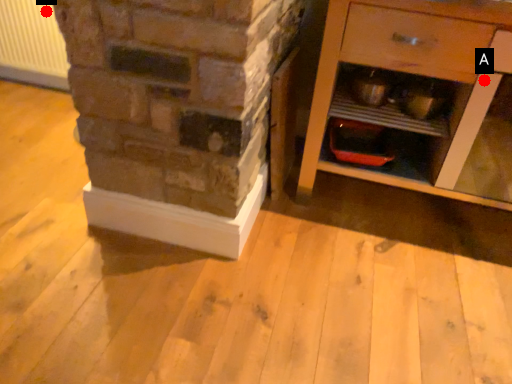
Question: Two points are circled on the image, labeled by A and B beside each circle. Which point is closer to the camera?

Choices:
 (A) A is closer
 (B) B is closer

Answer: (A)